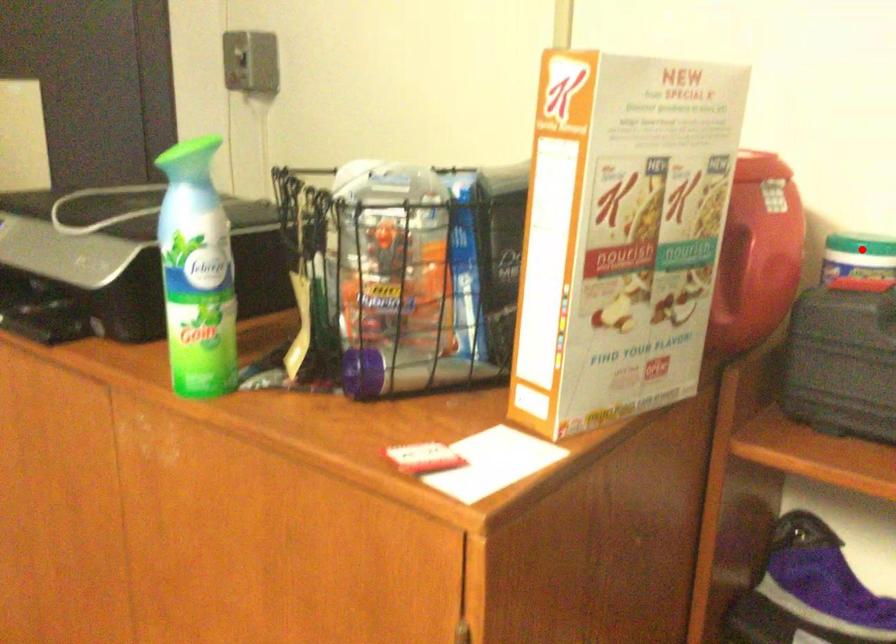
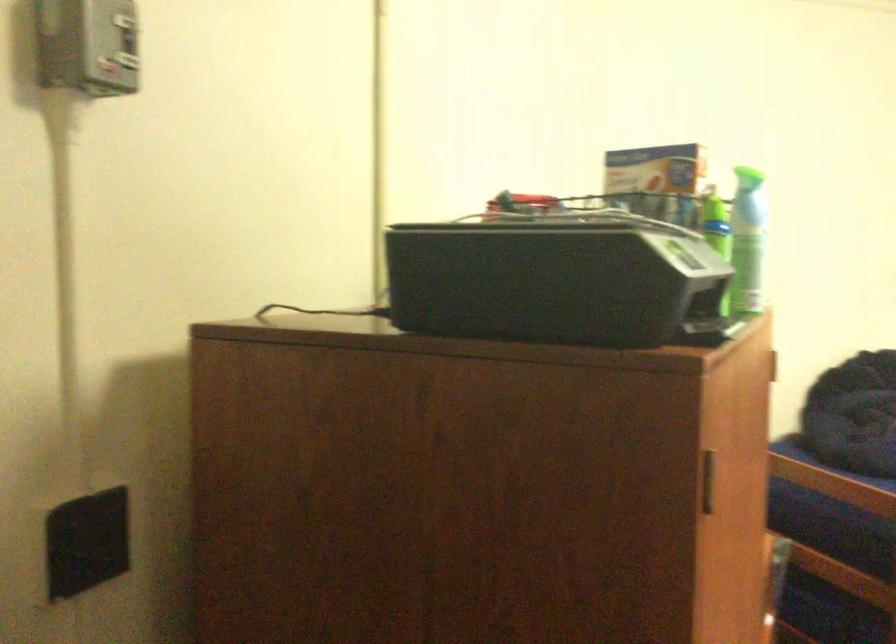
Question: I am providing you with two images of the same scene from different viewpoints. A red point is marked on the first image. At the location where the point appears in image 1, is it still visible in image 2?

Choices:
 (A) Yes
 (B) No

Answer: (B)